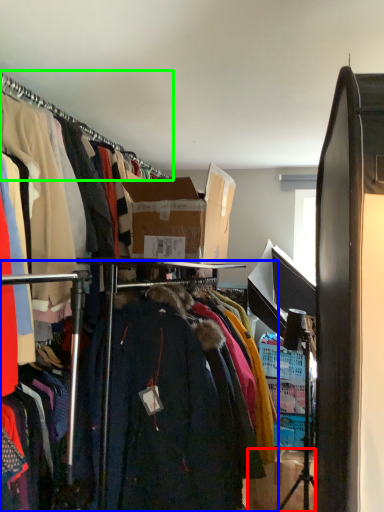
Question: Estimate the real-world distances between objects in this image. Which object is closer to box (highlighted by a red box), closet (highlighted by a blue box) or hanger (highlighted by a green box)?

Choices:
 (A) closet
 (B) hanger

Answer: (A)